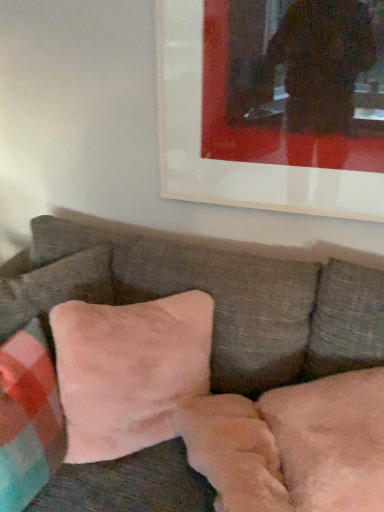
Where is `suede-like beige pillow at lower left, the 2th pillow viewed from the left`? The height and width of the screenshot is (512, 384). suede-like beige pillow at lower left, the 2th pillow viewed from the left is located at coordinates (55, 287).

What is the approximate height of suede-like pink pillow at center, which appears as the first pillow when viewed from the right?

It is 18.27 inches.

This screenshot has width=384, height=512. I want to click on suede-like pink pillow at center, arranged as the third pillow when viewed from the left, so click(130, 371).

Identify the location of suede-like beige pillow at lower left, the 2th pillow viewed from the left. This screenshot has width=384, height=512. (55, 287).

Relative to velvet pink pillow at center, is suede-like beige pillow at lower left, the 2th pillow viewed from the left, in front or behind?

Visually, suede-like beige pillow at lower left, the 2th pillow viewed from the left, is located behind velvet pink pillow at center.

Is suede-like beige pillow at lower left, the 2th pillow viewed from the left, placed right next to velvet pink pillow at center?

No, suede-like beige pillow at lower left, the 2th pillow viewed from the left, is not making contact with velvet pink pillow at center.

Considering the sizes of suede-like beige pillow at lower left, the 2th pillow viewed from the left, and velvet pink pillow at center in the image, is suede-like beige pillow at lower left, the 2th pillow viewed from the left, bigger or smaller than velvet pink pillow at center?

In the image, suede-like beige pillow at lower left, the 2th pillow viewed from the left, appears to be smaller than velvet pink pillow at center.

Which of these two, velvet pink pillow at center, the third pillow from the right, or velvet pink pillow at center, stands shorter?

velvet pink pillow at center, the third pillow from the right.

Based on the photo, considering the positions of objects velvet pink pillow at center, placed as the 1th pillow when sorted from left to right, and velvet pink pillow at center in the image provided, who is in front, velvet pink pillow at center, placed as the 1th pillow when sorted from left to right, or velvet pink pillow at center?

velvet pink pillow at center is more forward.

Which of these two, velvet pink pillow at center, the third pillow from the right, or velvet pink pillow at center, is thinner?

velvet pink pillow at center, the third pillow from the right, is thinner.

From a real-world perspective, is velvet pink pillow at center, placed as the 1th pillow when sorted from left to right, physically located above or below velvet pink pillow at center?

Clearly, from a real-world perspective, velvet pink pillow at center, placed as the 1th pillow when sorted from left to right, is above velvet pink pillow at center.

From a real-world perspective, is velvet pink pillow at center below suede-like beige pillow at lower left, the 2th pillow viewed from the left?

Indeed, from a real-world perspective, velvet pink pillow at center is positioned beneath suede-like beige pillow at lower left, the 2th pillow viewed from the left.

Is point (62, 508) less distant than point (90, 270)?

Yes, point (62, 508) is closer to viewer.

What's the angular difference between velvet pink pillow at center and suede-like beige pillow at lower left, the 2th pillow viewed from the left,'s facing directions?

The angle between the facing direction of velvet pink pillow at center and the facing direction of suede-like beige pillow at lower left, the 2th pillow viewed from the left, is 38.9 degrees.

Would you say velvet pink pillow at center is inside or outside suede-like beige pillow at lower left, the second pillow from the right?

velvet pink pillow at center is located beyond the bounds of suede-like beige pillow at lower left, the second pillow from the right.

Consider the image. Is velvet pink pillow at center taller or shorter than velvet pink pillow at center, placed as the 1th pillow when sorted from left to right?

In the image, velvet pink pillow at center appears to be taller than velvet pink pillow at center, placed as the 1th pillow when sorted from left to right.

Is velvet pink pillow at center inside the boundaries of velvet pink pillow at center, the third pillow from the right, or outside?

velvet pink pillow at center cannot be found inside velvet pink pillow at center, the third pillow from the right.

From a real-world perspective, which is physically below, velvet pink pillow at center or velvet pink pillow at center, the third pillow from the right?

velvet pink pillow at center, from a real-world perspective.

Starting from the velvet pink pillow at center, which pillow is the 1st one behind? Please provide its 2D coordinates.

[(28, 418)]

Can you confirm if suede-like beige pillow at lower left, the 2th pillow viewed from the left, is thinner than suede-like pink pillow at center, arranged as the third pillow when viewed from the left?

Correct, the width of suede-like beige pillow at lower left, the 2th pillow viewed from the left, is less than that of suede-like pink pillow at center, arranged as the third pillow when viewed from the left.

Is suede-like beige pillow at lower left, the 2th pillow viewed from the left, positioned with its back to suede-like pink pillow at center, arranged as the third pillow when viewed from the left?

No, suede-like beige pillow at lower left, the 2th pillow viewed from the left, is not facing the opposite direction of suede-like pink pillow at center, arranged as the third pillow when viewed from the left.

Which is in front, suede-like beige pillow at lower left, the 2th pillow viewed from the left, or suede-like pink pillow at center, arranged as the third pillow when viewed from the left?

Positioned in front is suede-like pink pillow at center, arranged as the third pillow when viewed from the left.

Is suede-like beige pillow at lower left, the 2th pillow viewed from the left, positioned far away from suede-like pink pillow at center, which appears as the first pillow when viewed from the right?

No.

Is suede-like pink pillow at center, which appears as the first pillow when viewed from the right, thinner than suede-like beige pillow at lower left, the second pillow from the right?

No.

From the image's perspective, is suede-like pink pillow at center, which appears as the first pillow when viewed from the right, above or below suede-like beige pillow at lower left, the 2th pillow viewed from the left?

Clearly, from the image's perspective, suede-like pink pillow at center, which appears as the first pillow when viewed from the right, is below suede-like beige pillow at lower left, the 2th pillow viewed from the left.

Could you tell me if suede-like pink pillow at center, arranged as the third pillow when viewed from the left, is facing suede-like beige pillow at lower left, the 2th pillow viewed from the left?

No.

From a real-world perspective, which object rests below the other?

From a 3D spatial view, suede-like pink pillow at center, arranged as the third pillow when viewed from the left, is below.

Between velvet pink pillow at center, placed as the 1th pillow when sorted from left to right, and suede-like beige pillow at lower left, the 2th pillow viewed from the left, which one appears on the right side from the viewer's perspective?

From the viewer's perspective, suede-like beige pillow at lower left, the 2th pillow viewed from the left, appears more on the right side.

Between velvet pink pillow at center, the third pillow from the right, and suede-like beige pillow at lower left, the 2th pillow viewed from the left, which one has smaller width?

Thinner between the two is suede-like beige pillow at lower left, the 2th pillow viewed from the left.

What's the angular difference between velvet pink pillow at center, the third pillow from the right, and suede-like beige pillow at lower left, the second pillow from the right,'s facing directions?

34.5 degrees separate the facing orientations of velvet pink pillow at center, the third pillow from the right, and suede-like beige pillow at lower left, the second pillow from the right.

Could suede-like beige pillow at lower left, the 2th pillow viewed from the left, be considered to be inside velvet pink pillow at center, placed as the 1th pillow when sorted from left to right?

No, suede-like beige pillow at lower left, the 2th pillow viewed from the left, is not inside velvet pink pillow at center, placed as the 1th pillow when sorted from left to right.

At what (x,y) coordinates should I click in order to perform the action: click on studio couch below the suede-like beige pillow at lower left, the second pillow from the right (from a real-world perspective). Please return your answer as a coordinate pair (x, y). The image size is (384, 512). Looking at the image, I should click on (213, 298).

This screenshot has width=384, height=512. Find the location of `studio couch below the velvet pink pillow at center, placed as the 1th pillow when sorted from left to right (from the image's perspective)`. studio couch below the velvet pink pillow at center, placed as the 1th pillow when sorted from left to right (from the image's perspective) is located at coordinates (213, 298).

Based on the photo, when comparing their distances from suede-like pink pillow at center, arranged as the third pillow when viewed from the left, does velvet pink pillow at center, the third pillow from the right, or suede-like beige pillow at lower left, the second pillow from the right, seem closer?

velvet pink pillow at center, the third pillow from the right, lies closer to suede-like pink pillow at center, arranged as the third pillow when viewed from the left, than the other object.

Considering their positions, is suede-like pink pillow at center, arranged as the third pillow when viewed from the left, positioned closer to velvet pink pillow at center, placed as the 1th pillow when sorted from left to right, than velvet pink pillow at center?

Based on the image, suede-like pink pillow at center, arranged as the third pillow when viewed from the left, appears to be nearer to velvet pink pillow at center, placed as the 1th pillow when sorted from left to right.

Which object lies nearer to the anchor point velvet pink pillow at center, the third pillow from the right, suede-like pink pillow at center, arranged as the third pillow when viewed from the left, or suede-like beige pillow at lower left, the second pillow from the right?

suede-like pink pillow at center, arranged as the third pillow when viewed from the left, is positioned closer to the anchor velvet pink pillow at center, the third pillow from the right.

Looking at this image, which object lies nearer to the anchor point suede-like beige pillow at lower left, the second pillow from the right, velvet pink pillow at center or suede-like pink pillow at center, arranged as the third pillow when viewed from the left?

velvet pink pillow at center.

Based on their spatial positions, is velvet pink pillow at center or suede-like beige pillow at lower left, the 2th pillow viewed from the left, closer to suede-like pink pillow at center, arranged as the third pillow when viewed from the left?

velvet pink pillow at center is closer to suede-like pink pillow at center, arranged as the third pillow when viewed from the left.

Based on their spatial positions, is suede-like pink pillow at center, arranged as the third pillow when viewed from the left, or velvet pink pillow at center, placed as the 1th pillow when sorted from left to right, further from velvet pink pillow at center?

The object further to velvet pink pillow at center is velvet pink pillow at center, placed as the 1th pillow when sorted from left to right.

Looking at the image, which one is located further to velvet pink pillow at center, suede-like beige pillow at lower left, the second pillow from the right, or suede-like pink pillow at center, arranged as the third pillow when viewed from the left?

suede-like pink pillow at center, arranged as the third pillow when viewed from the left.

Which object lies further to the anchor point velvet pink pillow at center, suede-like beige pillow at lower left, the second pillow from the right, or velvet pink pillow at center, the third pillow from the right?

Among the two, velvet pink pillow at center, the third pillow from the right, is located further to velvet pink pillow at center.

The width and height of the screenshot is (384, 512). In order to click on pillow positioned between velvet pink pillow at center, the third pillow from the right, and suede-like beige pillow at lower left, the 2th pillow viewed from the left, from near to far in this screenshot , I will do coord(130,371).

I want to click on pillow located between velvet pink pillow at center and suede-like pink pillow at center, which appears as the first pillow when viewed from the right, in the depth direction, so click(x=28, y=418).